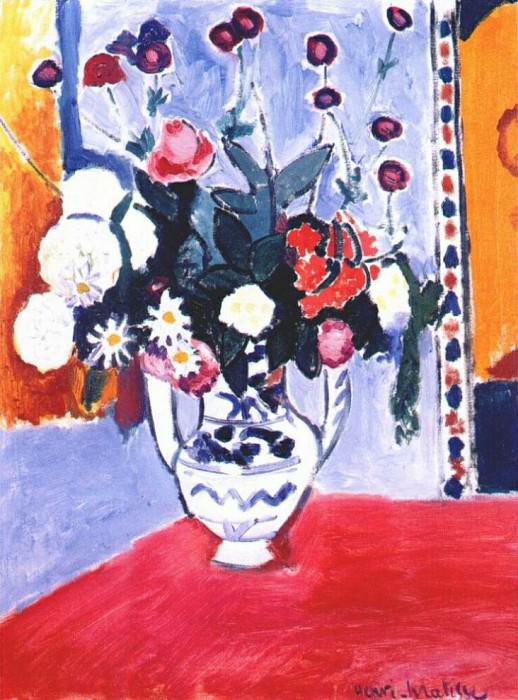
Find the location of a particular element. base of vase is located at coordinates (251, 554).